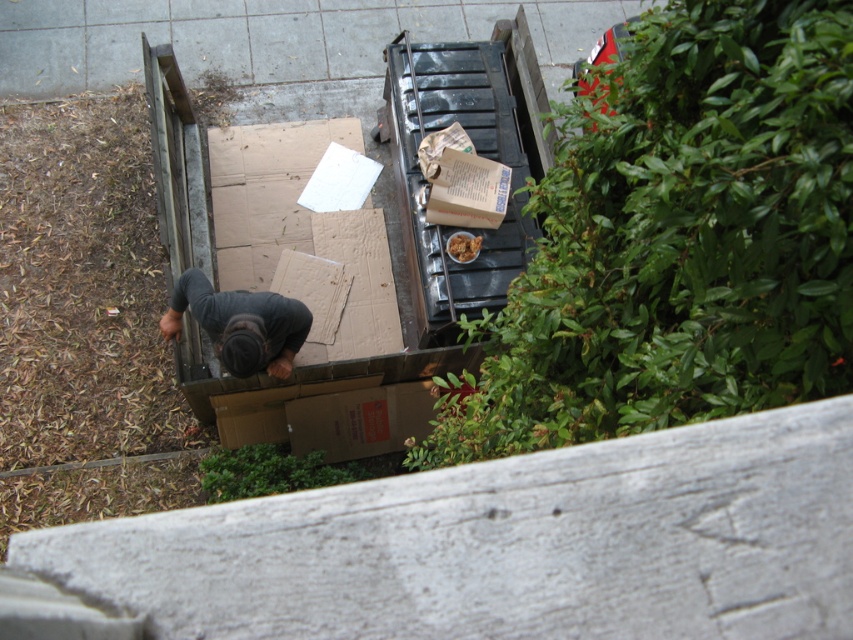
Does green leafy bush at upper right come in front of green leafy bush at lower center?

Yes, green leafy bush at upper right is in front of green leafy bush at lower center.

Find the location of a particular element. The height and width of the screenshot is (640, 853). green leafy bush at upper right is located at coordinates (679, 241).

The height and width of the screenshot is (640, 853). I want to click on green leafy bush at upper right, so coord(679,241).

Is dark gray fabric at lower center below green leafy bush at lower center?

Incorrect, dark gray fabric at lower center is not positioned below green leafy bush at lower center.

Locate an element on the screen. The width and height of the screenshot is (853, 640). dark gray fabric at lower center is located at coordinates (241, 324).

Does green leafy bush at upper right have a greater height compared to dark gray fabric at lower center?

Yes, green leafy bush at upper right is taller than dark gray fabric at lower center.

Does green leafy bush at upper right have a lesser width compared to dark gray fabric at lower center?

No, green leafy bush at upper right is not thinner than dark gray fabric at lower center.

Between point (811, 93) and point (241, 340), which one is positioned behind?

The point (241, 340) is more distant.

This screenshot has width=853, height=640. Find the location of `green leafy bush at upper right`. green leafy bush at upper right is located at coordinates (679, 241).